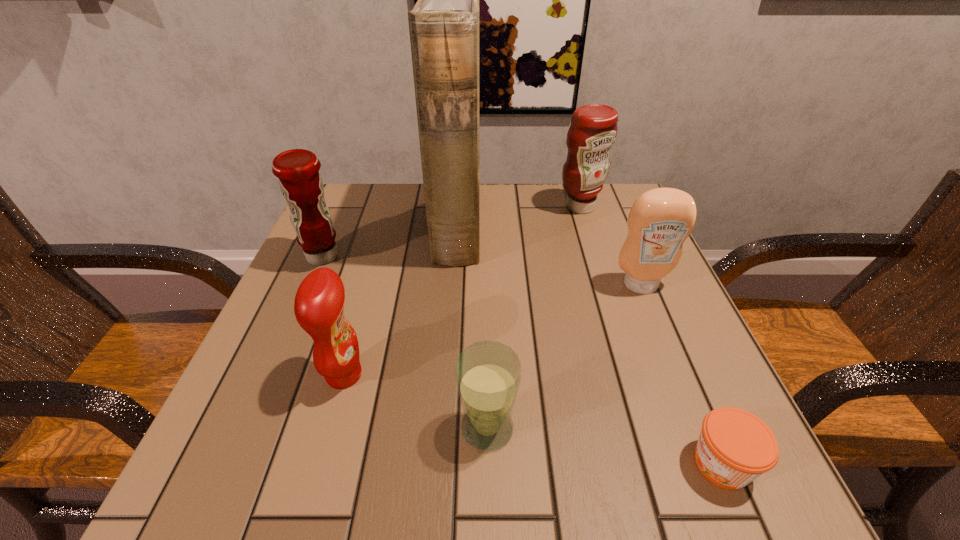
Identify the location of unoccupied area between the farthest condiment and the phonebook. (x=518, y=217).

Locate an element on the screen. This screenshot has height=540, width=960. empty space between the nearest condiment and the sixth tallest object is located at coordinates (416, 402).

Locate an element on the screen. The width and height of the screenshot is (960, 540). vacant space that is in between the phonebook and the leftmost object is located at coordinates (390, 241).

Identify which object is the fourth nearest to the second condiment from left to right. Please provide its 2D coordinates. Your answer should be formatted as a tuple, i.e. [(x, y)], where the tuple contains the x and y coordinates of a point satisfying the conditions above.

[(660, 220)]

Identify which object is the fifth closest to the farthest condiment. Please provide its 2D coordinates. Your answer should be formatted as a tuple, i.e. [(x, y)], where the tuple contains the x and y coordinates of a point satisfying the conditions above.

[(319, 302)]

Where is `condiment that can be found as the closest to the farthest condiment`? The width and height of the screenshot is (960, 540). condiment that can be found as the closest to the farthest condiment is located at coordinates (660, 220).

The height and width of the screenshot is (540, 960). What are the coordinates of `condiment object that ranks as the closest to the sixth tallest object` in the screenshot? It's located at (319, 302).

Locate an element on the screen. The width and height of the screenshot is (960, 540). free spot that satisfies the following two spatial constraints: 1. on the label side of the third nearest object; 2. on the back side of the glass is located at coordinates (329, 428).

The height and width of the screenshot is (540, 960). Find the location of `free space that satisfies the following two spatial constraints: 1. on the back side of the sixth tallest object; 2. on the left side of the farthest condiment`. free space that satisfies the following two spatial constraints: 1. on the back side of the sixth tallest object; 2. on the left side of the farthest condiment is located at coordinates (484, 207).

I want to click on vacant space that satisfies the following two spatial constraints: 1. on the back side of the glass; 2. on the cover of the tallest object, so click(485, 226).